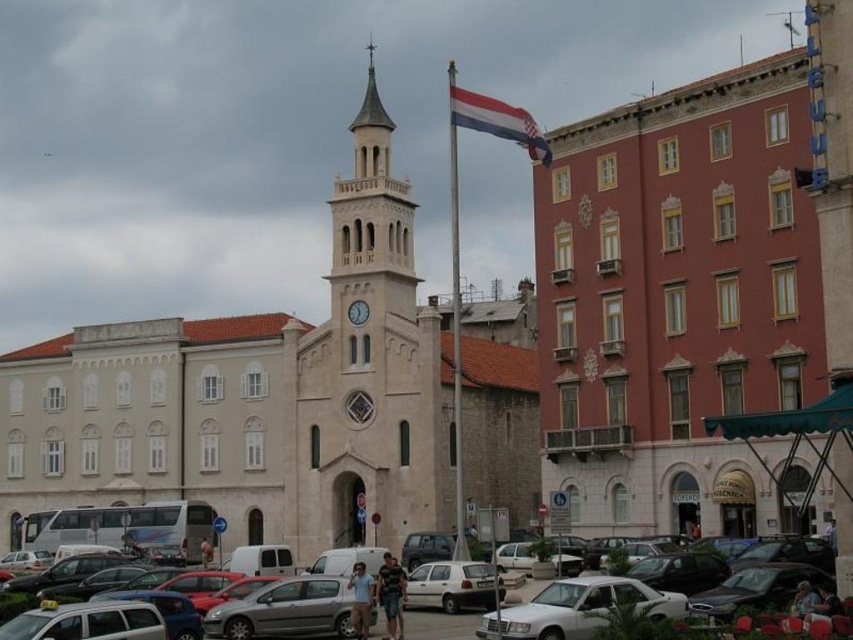
You are a city planner assessing the parking lot layout. The white stone clock tower at center and the silver metallic hatchback at center are both in the parking area. Which object has a greater width?

The white stone clock tower at center has a greater width than the silver metallic hatchback at center.

You are a city planner assessing the width of buildings for a renovation project. You observe the matte pink building at right and the white stone clock tower at center. Which building has a narrower width?

The matte pink building at right has a lesser width compared to the white stone clock tower at center, so the matte pink building at right is narrower.